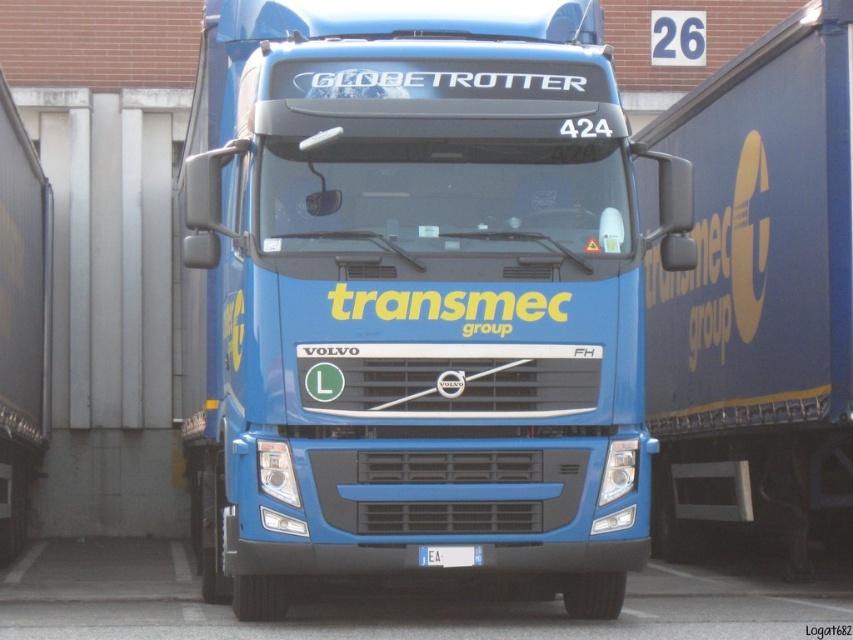
You are a delivery driver who just arrived at a warehouse. You need to check the license plate of the blue metallic truck at center to confirm it matches the one in your delivery manifest. However, you notice the white plastic license plate at center is partially obscured by the truck itself. Can you still see the entire license plate clearly?

The blue metallic truck at center is closer to the viewer than the white plastic license plate at center, so the truck is blocking part of the license plate, making it impossible to see the entire license plate clearly.

You are a delivery driver who needs to check the license plate number on the white plastic license plate at center. However, the blue matte trailer truck at right is blocking your view. Can you see the license plate clearly from your current position?

The white plastic license plate at center is behind the blue matte trailer truck at right, so it is obstructed and cannot be seen clearly from the current position.

You are a delivery driver who needs to park the blue matte trailer truck at right and the white plastic license plate at center in a garage with a height restriction of 2 meters. The license plate is already mounted on the truck. Can both items fit under the height limit?

The blue matte trailer truck at right is taller than the white plastic license plate at center. Since the license plate is mounted on the truck, the total height of the truck would exceed the height restriction of 2 meters. Therefore, the blue matte trailer truck at right cannot fit under the height limit.